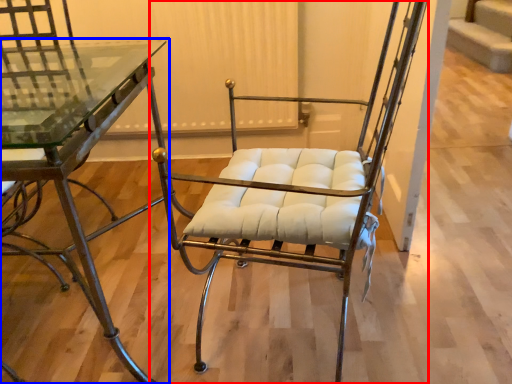
Question: Which object is further to the camera taking this photo, chair (highlighted by a red box) or table (highlighted by a blue box)?

Choices:
 (A) chair
 (B) table

Answer: (B)